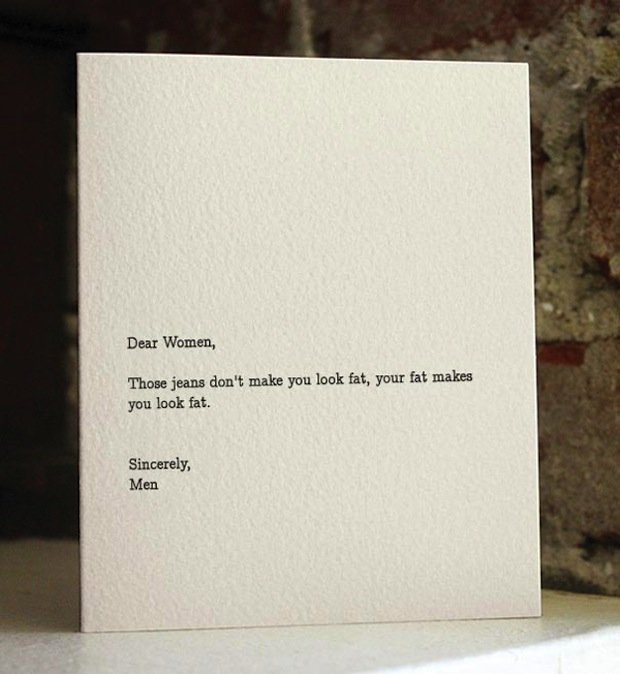
Locate an element on the screen. The height and width of the screenshot is (674, 620). surface is located at coordinates (237, 644).